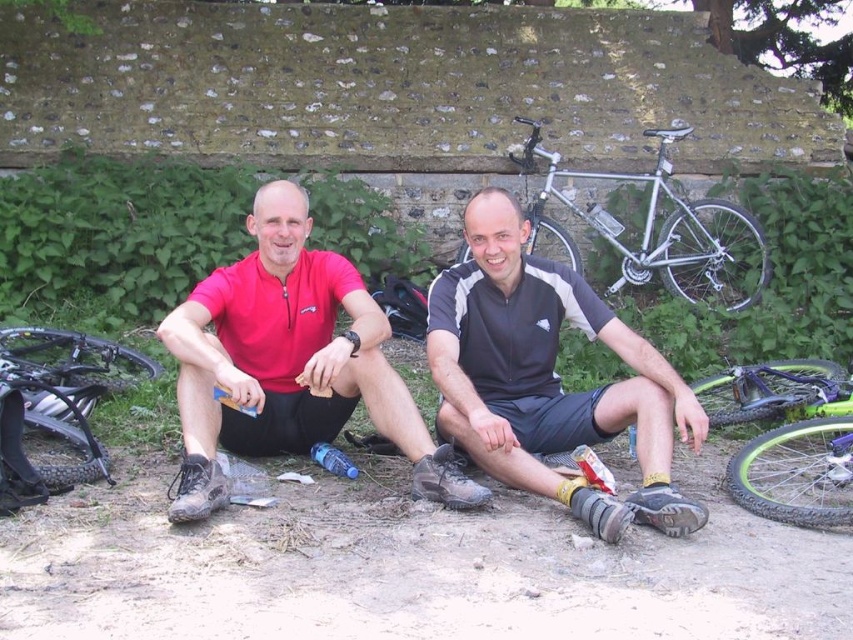
Which is below, matte red shirt at center or green rubber bicycle at lower right?

green rubber bicycle at lower right is lower down.

Does matte red shirt at center come behind green rubber bicycle at lower right?

No, matte red shirt at center is closer to the viewer.

This screenshot has height=640, width=853. I want to click on matte red shirt at center, so click(288, 362).

The width and height of the screenshot is (853, 640). I want to click on matte red shirt at center, so click(288, 362).

Based on the photo, can you confirm if green rubber bicycle at lower right is shorter than silver metallic bicycle at upper right?

Yes.

Between green rubber bicycle at lower right and silver metallic bicycle at upper right, which one is positioned lower?

green rubber bicycle at lower right

Between point (733, 397) and point (706, 204), which one is positioned behind?

The point (706, 204) is behind.

The width and height of the screenshot is (853, 640). I want to click on green rubber bicycle at lower right, so click(788, 438).

Does black matte shorts at center have a lesser width compared to silver metallic bicycle at upper right?

Correct, black matte shorts at center's width is less than silver metallic bicycle at upper right's.

How much distance is there between black matte shorts at center and silver metallic bicycle at upper right?

black matte shorts at center and silver metallic bicycle at upper right are 4.35 meters apart.

Between point (454, 438) and point (669, 257), which one is positioned in front?

Point (454, 438) is more forward.

Locate an element on the screen. black matte shorts at center is located at coordinates (548, 378).